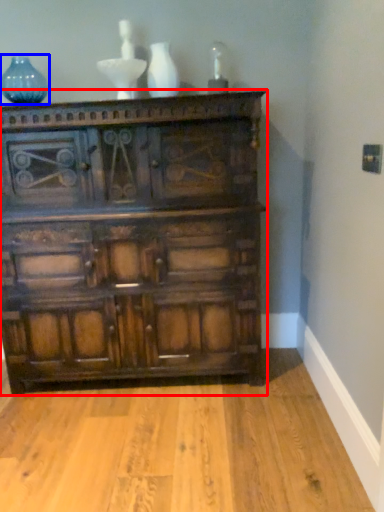
Question: Which object is closer to the camera taking this photo, chest of drawers (highlighted by a red box) or glass vase (highlighted by a blue box)?

Choices:
 (A) chest of drawers
 (B) glass vase

Answer: (A)